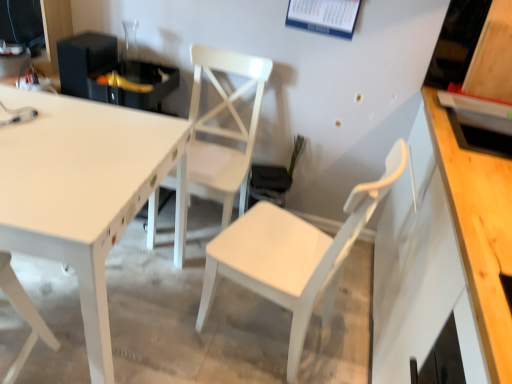
Question: In the image, is white matte chair at lower left, which appears as the 1th chair when viewed from the left, positioned in front of or behind white glossy table at upper left?

Choices:
 (A) front
 (B) behind

Answer: (A)

Question: Is white matte chair at lower left, which appears as the 1th chair when viewed from the left, wider or thinner than white glossy table at upper left?

Choices:
 (A) wide
 (B) thin

Answer: (B)

Question: Estimate the real-world distances between objects in this image. Which object is closer to the white matte chair at center, which is counted as the 3th chair, starting from the left?

Choices:
 (A) white glossy table at upper left
 (B) white matte chair at center, the second chair from the left
 (C) white matte chair at lower left, which appears as the 3th chair when viewed from the right

Answer: (A)

Question: Which object is the farthest from the white matte chair at center, which ranks as the first chair in right-to-left order?

Choices:
 (A) white glossy table at upper left
 (B) white matte chair at center, the second chair from the left
 (C) white matte chair at lower left, which appears as the 1th chair when viewed from the left

Answer: (C)